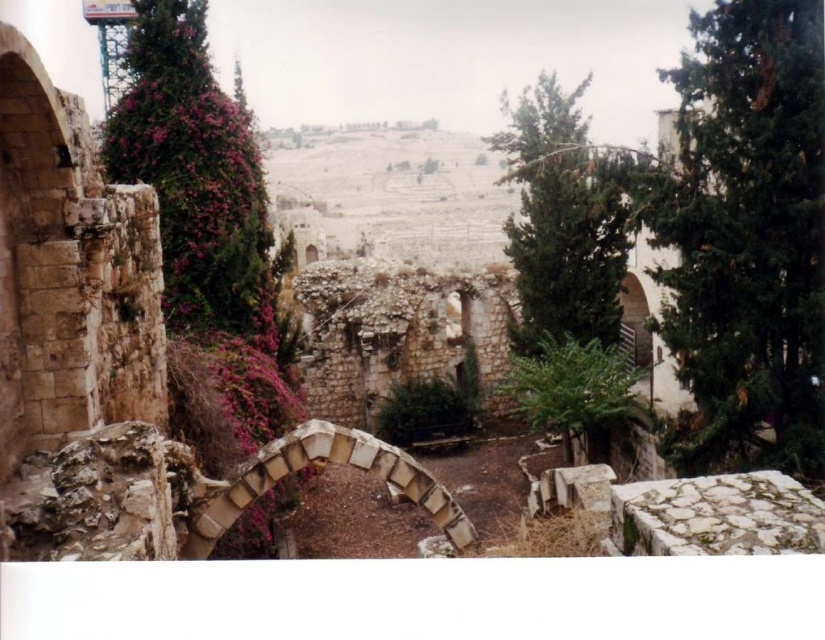
Is green textured tree at right to the right of green leafy tree at upper right from the viewer's perspective?

In fact, green textured tree at right is to the left of green leafy tree at upper right.

Who is positioned more to the left, green textured tree at right or green leafy tree at upper right?

green textured tree at right is more to the left.

Is point (819, 346) less distant than point (536, 88)?

That is True.

Find the location of a particular element. green textured tree at right is located at coordinates (746, 236).

Is pink textured foliage at left to the left of green leafy tree at upper right from the viewer's perspective?

Correct, you'll find pink textured foliage at left to the left of green leafy tree at upper right.

Is pink textured foliage at left above green leafy tree at upper right?

No, pink textured foliage at left is not above green leafy tree at upper right.

Who is more forward, (218, 276) or (500, 97)?

Point (218, 276) is in front.

Locate an element on the screen. Image resolution: width=825 pixels, height=640 pixels. pink textured foliage at left is located at coordinates (196, 177).

Where is `green textured tree at right`? Image resolution: width=825 pixels, height=640 pixels. green textured tree at right is located at coordinates (746, 236).

Is green textured tree at right further to camera compared to pink textured foliage at left?

That is False.

Does point (757, 321) lie in front of point (165, 49)?

Yes.

Where is `green textured tree at right`? The image size is (825, 640). green textured tree at right is located at coordinates (746, 236).